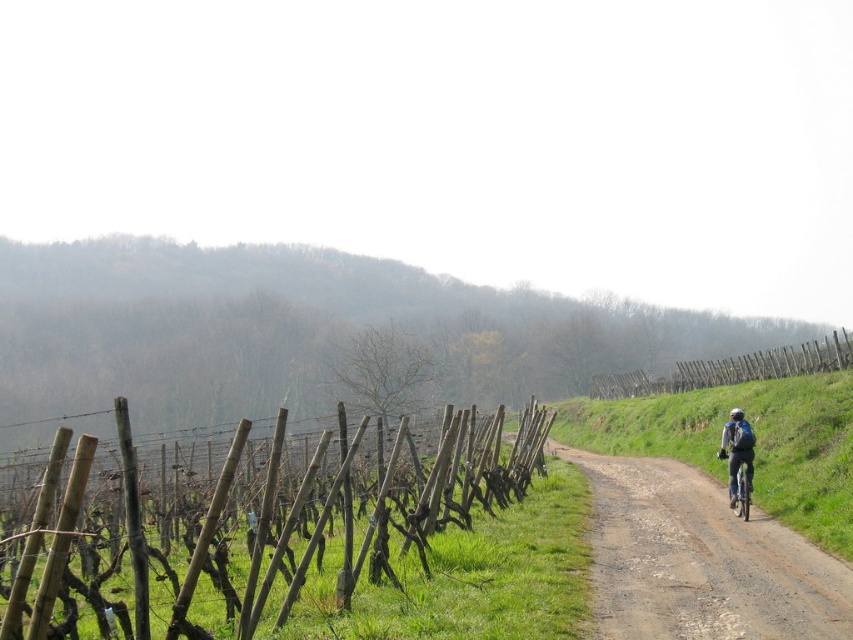
Question: Can you confirm if brown wooden fence at left is wider than shiny blue helmet at right?

Choices:
 (A) yes
 (B) no

Answer: (A)

Question: Among these objects, which one is farthest from the camera?

Choices:
 (A) green fabric helmet at right
 (B) brown wooden fence at left
 (C) shiny blue helmet at right

Answer: (C)

Question: Can you confirm if matte blue bicycle at right is bigger than shiny blue helmet at right?

Choices:
 (A) yes
 (B) no

Answer: (B)

Question: Among these objects, which one is farthest from the camera?

Choices:
 (A) wooden fence at right
 (B) green fabric helmet at right
 (C) green matte bicycle at right
 (D) brown wooden fence at left

Answer: (A)

Question: Considering the relative positions of wooden fence at right and matte blue bicycle at right in the image provided, where is wooden fence at right located with respect to matte blue bicycle at right?

Choices:
 (A) right
 (B) left

Answer: (A)

Question: Which object appears closest to the camera in this image?

Choices:
 (A) green fabric helmet at right
 (B) matte blue bicycle at right

Answer: (B)